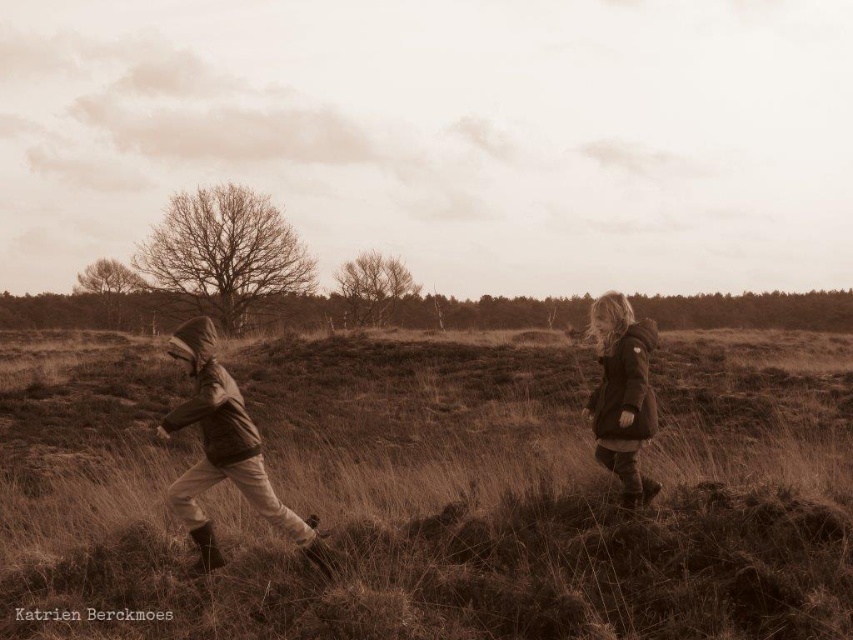
Question: Which of these objects is positioned farthest from the matte brown jacket at right?

Choices:
 (A) brown matte jacket at left
 (B) brown grassy at center

Answer: (B)

Question: Does brown grassy at center appear over matte brown jacket at right?

Choices:
 (A) no
 (B) yes

Answer: (A)

Question: Is brown matte jacket at left above matte brown jacket at right?

Choices:
 (A) yes
 (B) no

Answer: (B)

Question: Which of the following is the farthest from the observer?

Choices:
 (A) brown matte jacket at left
 (B) matte brown jacket at right
 (C) brown grassy at center

Answer: (B)

Question: Among these points, which one is nearest to the camera?

Choices:
 (A) (505, 520)
 (B) (618, 417)
 (C) (252, 435)

Answer: (C)

Question: Does brown grassy at center have a smaller size compared to matte brown jacket at right?

Choices:
 (A) yes
 (B) no

Answer: (B)